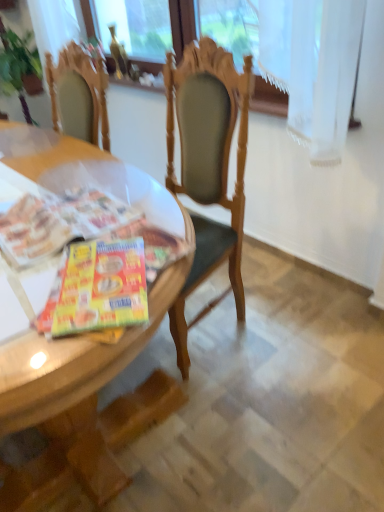
Question: Is gold glass bottle at upper center taller than shiny plastic magazine at table left?

Choices:
 (A) yes
 (B) no

Answer: (A)

Question: Are gold glass bottle at upper center and shiny plastic magazine at table left far apart?

Choices:
 (A) no
 (B) yes

Answer: (B)

Question: Considering the relative sizes of gold glass bottle at upper center and shiny plastic magazine at table left in the image provided, is gold glass bottle at upper center smaller than shiny plastic magazine at table left?

Choices:
 (A) no
 (B) yes

Answer: (B)

Question: Is gold glass bottle at upper center positioned in front of shiny plastic magazine at table left?

Choices:
 (A) no
 (B) yes

Answer: (A)

Question: Can we say gold glass bottle at upper center lies outside shiny plastic magazine at table left?

Choices:
 (A) no
 (B) yes

Answer: (B)

Question: Does gold glass bottle at upper center appear on the left side of shiny plastic magazine at table left?

Choices:
 (A) yes
 (B) no

Answer: (A)

Question: Can we say wooden desk at center lies outside shiny plastic magazine at table left?

Choices:
 (A) yes
 (B) no

Answer: (A)

Question: Is the position of wooden desk at center more distant than that of shiny plastic magazine at table left?

Choices:
 (A) no
 (B) yes

Answer: (A)

Question: Does wooden desk at center have a greater height compared to shiny plastic magazine at table left?

Choices:
 (A) yes
 (B) no

Answer: (A)

Question: Could you tell me if wooden desk at center is turned towards shiny plastic magazine at table left?

Choices:
 (A) yes
 (B) no

Answer: (B)

Question: Can you confirm if wooden desk at center is shorter than shiny plastic magazine at table left?

Choices:
 (A) yes
 (B) no

Answer: (B)

Question: From a real-world perspective, is wooden desk at center located beneath shiny plastic magazine at table left?

Choices:
 (A) yes
 (B) no

Answer: (A)

Question: From the image's perspective, would you say gold glass bottle at upper center is positioned over wooden desk at center?

Choices:
 (A) yes
 (B) no

Answer: (A)